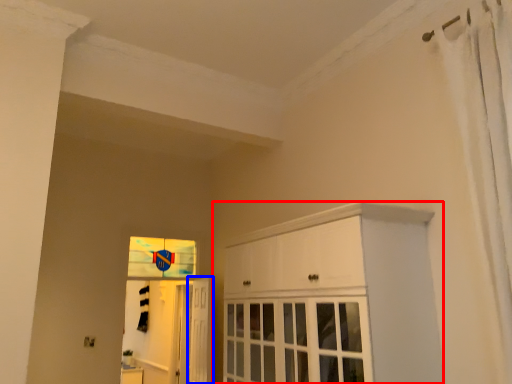
Question: Among these objects, which one is farthest to the camera, cabinetry (highlighted by a red box) or door (highlighted by a blue box)?

Choices:
 (A) cabinetry
 (B) door

Answer: (B)